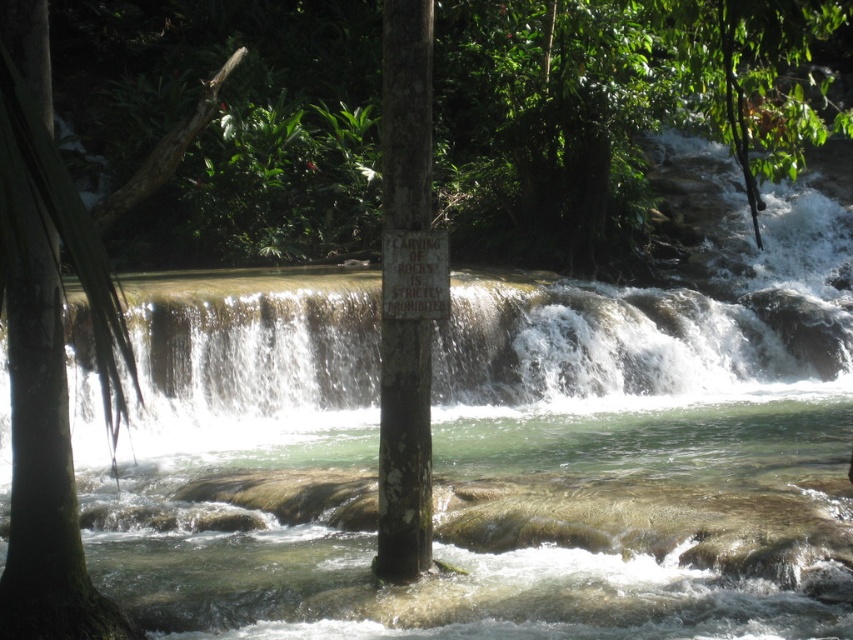
Question: Which object appears farthest from the camera in this image?

Choices:
 (A) translucent white water at center
 (B) green rough bark tree at left

Answer: (A)

Question: Observing the image, what is the correct spatial positioning of translucent white water at center in reference to green rough bark tree at left?

Choices:
 (A) right
 (B) left

Answer: (A)

Question: Can you confirm if translucent white water at center is wider than green rough bark tree at left?

Choices:
 (A) no
 (B) yes

Answer: (B)

Question: Is translucent white water at center wider than green rough bark tree at left?

Choices:
 (A) yes
 (B) no

Answer: (A)